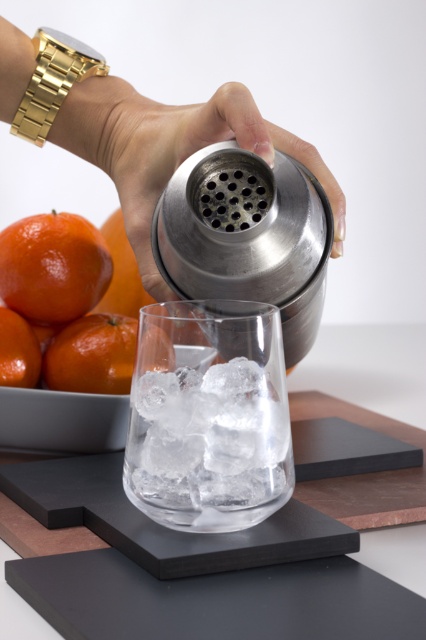
Locate an element on the screen. polished metallic cocktail shaker at center is located at coordinates (247, 236).

Does polished metallic cocktail shaker at center have a lesser width compared to metallic silver shaker at center?

Yes.

Image resolution: width=426 pixels, height=640 pixels. I want to click on polished metallic cocktail shaker at center, so click(247, 236).

Is metallic silver shaker at center wider than orangesmoothorange at lower left?

Yes, metallic silver shaker at center is wider than orangesmoothorange at lower left.

Which of these two, metallic silver shaker at center or orangesmoothorange at lower left, stands shorter?

With less height is orangesmoothorange at lower left.

Is point (160, 140) more distant than point (0, 337)?

No, (160, 140) is closer to viewer.

At what (x,y) coordinates should I click in order to perform the action: click on metallic silver shaker at center. Please return your answer as a coordinate pair (x, y). This screenshot has width=426, height=640. Looking at the image, I should click on (189, 154).

Who is more distant from viewer, (124,246) or (5,376)?

The point (124,246) is more distant.

Does orangesmoothorange at left have a greater height compared to orangesmoothorange at lower left?

Yes, orangesmoothorange at left is taller than orangesmoothorange at lower left.

Who is more forward, (135, 268) or (6, 353)?

Point (6, 353) is in front.

Locate an element on the screen. orangesmoothorange at left is located at coordinates (121, 273).